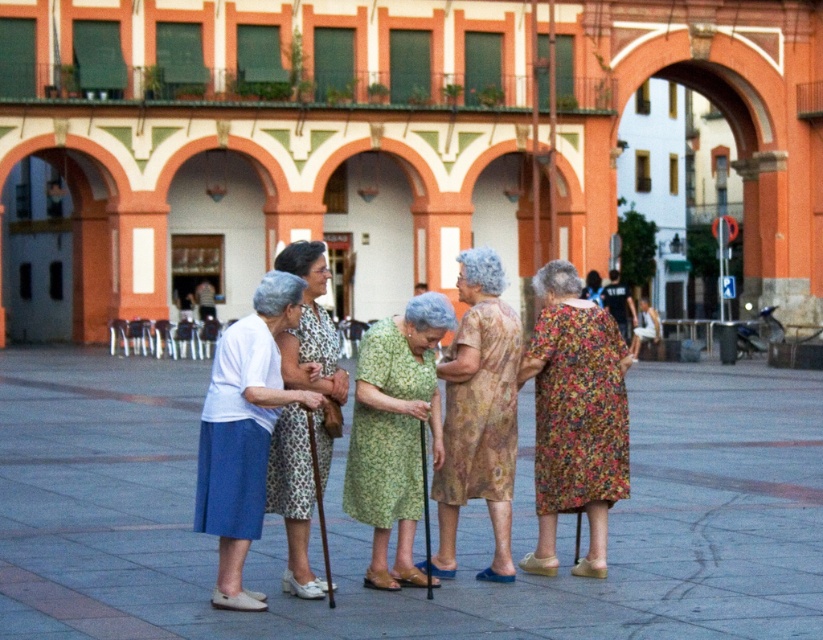
Which of these two, floral print dress at center or green floral dress at center, stands shorter?

With less height is green floral dress at center.

Does floral print dress at center have a lesser height compared to green floral dress at center?

No, floral print dress at center is not shorter than green floral dress at center.

The width and height of the screenshot is (823, 640). In order to click on floral print dress at center in this screenshot , I will do `click(575, 417)`.

I want to click on floral print dress at center, so click(575, 417).

Between floral print dress at center and white cotton dress at center, which one is positioned lower?

white cotton dress at center is below.

The image size is (823, 640). Describe the element at coordinates (575, 417) in the screenshot. I see `floral print dress at center` at that location.

Describe the element at coordinates (575, 417) in the screenshot. I see `floral print dress at center` at that location.

Locate an element on the screen. The width and height of the screenshot is (823, 640). floral print dress at center is located at coordinates (575, 417).

Is floral print dress at center to the right of printed fabric dress at center from the viewer's perspective?

Yes, floral print dress at center is to the right of printed fabric dress at center.

Is floral print dress at center wider than printed fabric dress at center?

In fact, floral print dress at center might be narrower than printed fabric dress at center.

In the scene shown: Measure the distance between floral print dress at center and camera.

A distance of 13.28 meters exists between floral print dress at center and camera.

You are a GUI agent. You are given a task and a screenshot of the screen. Output one action in this format:
    pyautogui.click(x=<x>, y=<y>)
    Task: Click on the floral print dress at center
    This screenshot has height=640, width=823.
    Given the screenshot: What is the action you would take?
    pyautogui.click(x=575, y=417)